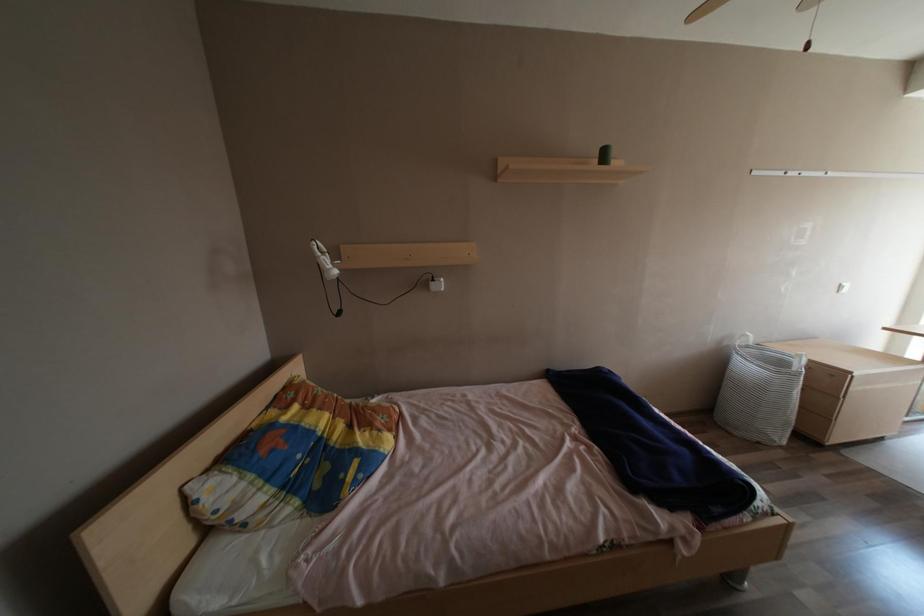
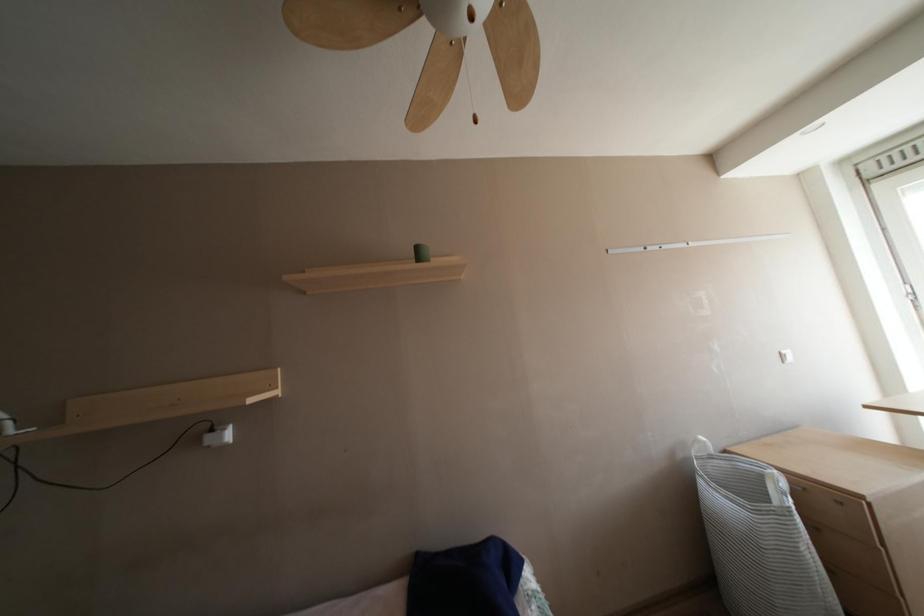
Question: Based on the continuous images, in which direction is the camera rotating? Reply with the corresponding letter.

Choices:
 (A) Left
 (B) Right
 (C) Up
 (D) Down

Answer: (C)